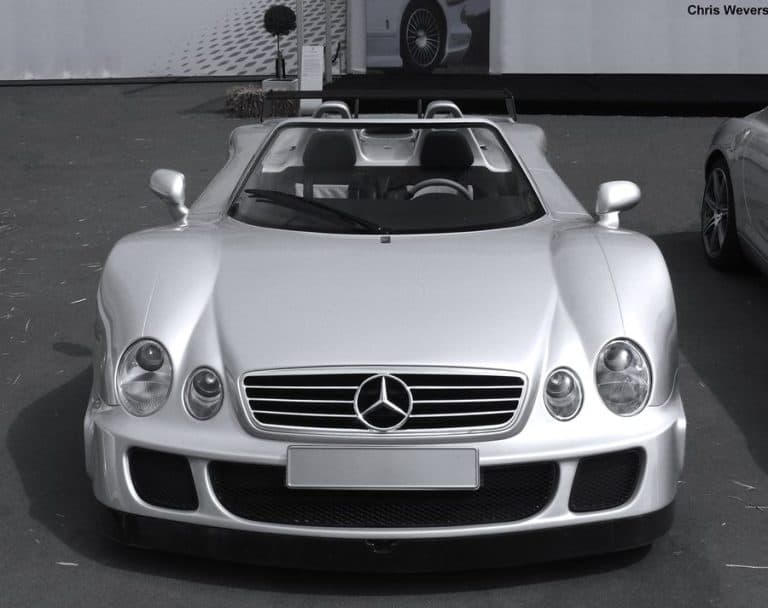
The image size is (768, 608). In order to click on 2 seats shown in this screenshot , I will do `click(329, 165)`, `click(461, 163)`.